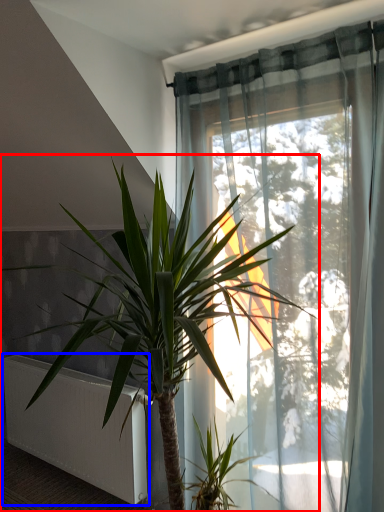
Question: Which object appears farthest to the camera in this image, houseplant (highlighted by a red box) or radiator (highlighted by a blue box)?

Choices:
 (A) houseplant
 (B) radiator

Answer: (B)